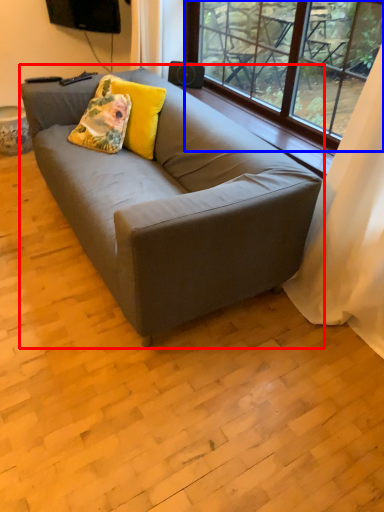
Question: Which point is closer to the camera, studio couch (highlighted by a red box) or window (highlighted by a blue box)?

Choices:
 (A) studio couch
 (B) window

Answer: (A)